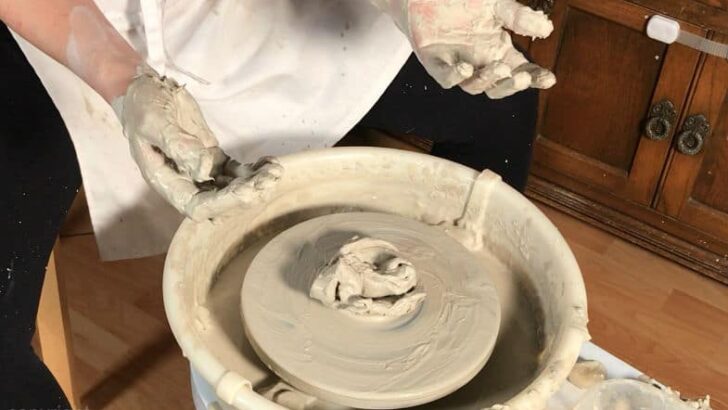
Where is `hardwood floor`? This screenshot has height=410, width=728. hardwood floor is located at coordinates (620, 325).